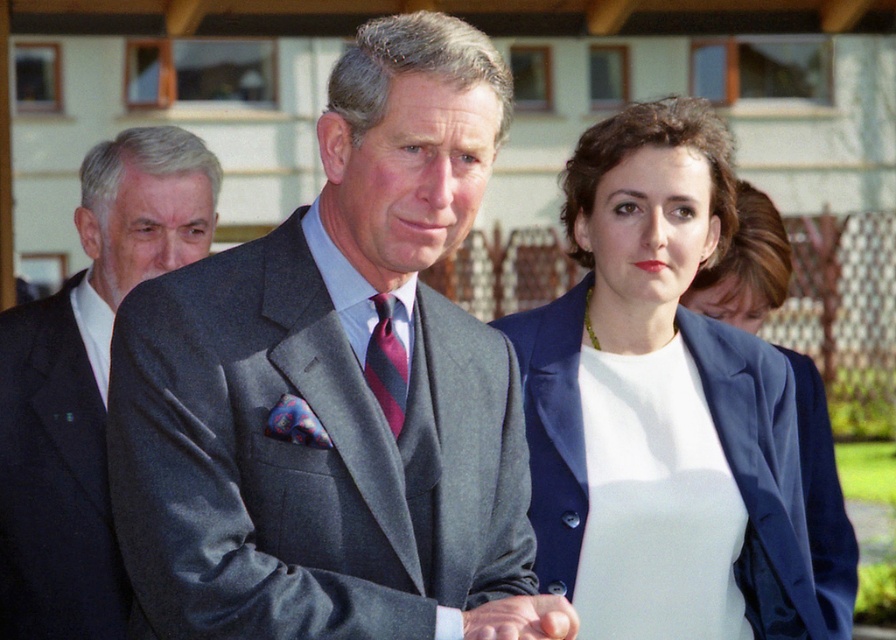
Question: Among these points, which one is nearest to the camera?

Choices:
 (A) (757, 275)
 (B) (481, 499)
 (C) (514, 621)
 (D) (90, 625)

Answer: (C)

Question: Can you confirm if dark gray suit at left is positioned to the left of smooth skin hand at center?

Choices:
 (A) yes
 (B) no

Answer: (A)

Question: Does dark gray suit at left have a smaller size compared to dark gray wool suit at left?

Choices:
 (A) no
 (B) yes

Answer: (A)

Question: Among these objects, which one is nearest to the camera?

Choices:
 (A) gray wool suit at center
 (B) satin blue blazer at center

Answer: (A)

Question: Can you confirm if white matte dress at center is positioned above navy blue fabric suit at right?

Choices:
 (A) yes
 (B) no

Answer: (A)

Question: Which point is closer to the camera taking this photo?

Choices:
 (A) (398, 504)
 (B) (672, 524)
 (C) (532, 596)

Answer: (A)